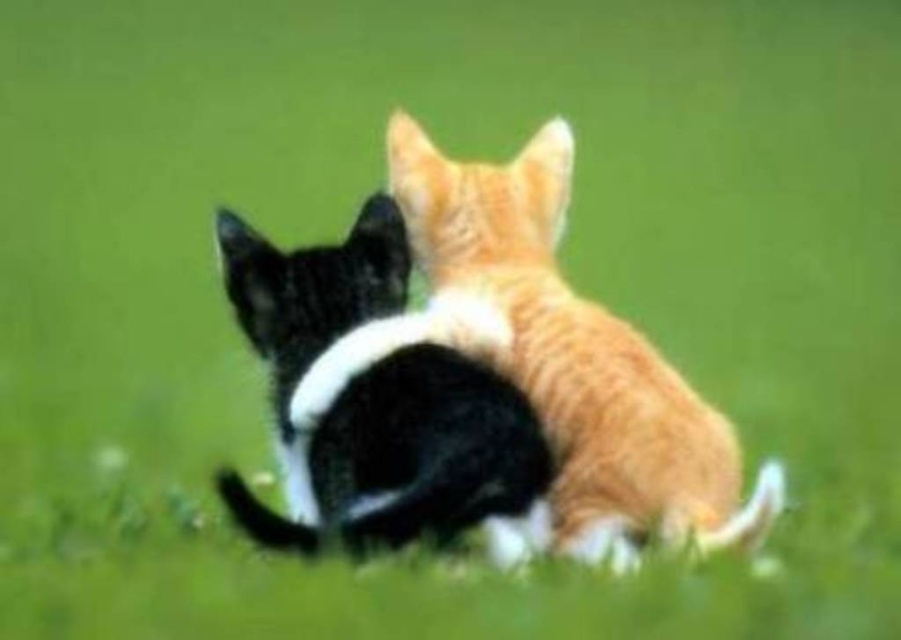
Who is taller, orange fur cat at center or black and white fur cat at center?

With more height is orange fur cat at center.

Is orange fur cat at center to the left of black and white fur cat at center from the viewer's perspective?

No, orange fur cat at center is not to the left of black and white fur cat at center.

Is point (446, 224) positioned after point (221, 474)?

Yes, point (446, 224) is behind point (221, 474).

Find the location of a particular element. orange fur cat at center is located at coordinates (578, 356).